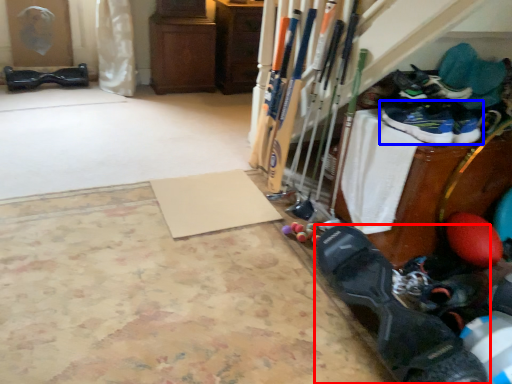
Question: Which point is further to the camera, footwear (highlighted by a red box) or footwear (highlighted by a blue box)?

Choices:
 (A) footwear
 (B) footwear

Answer: (B)